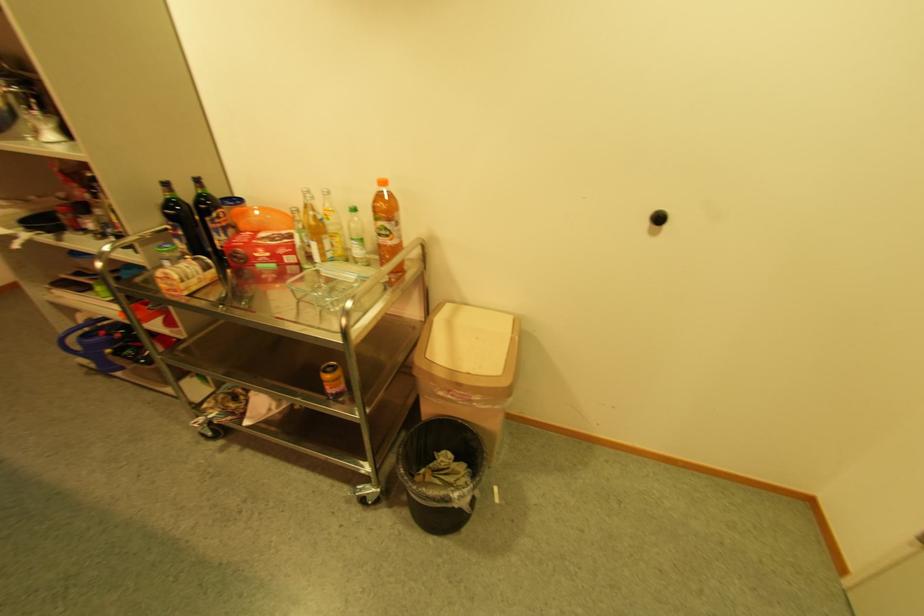
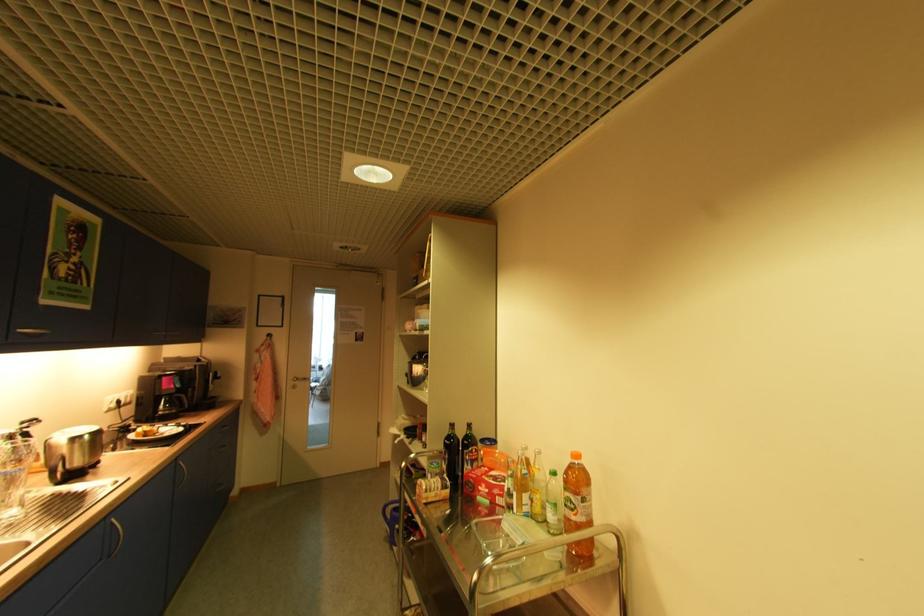
The point at (391,233) is marked in the first image. Where is the corresponding point in the second image?

(575, 506)